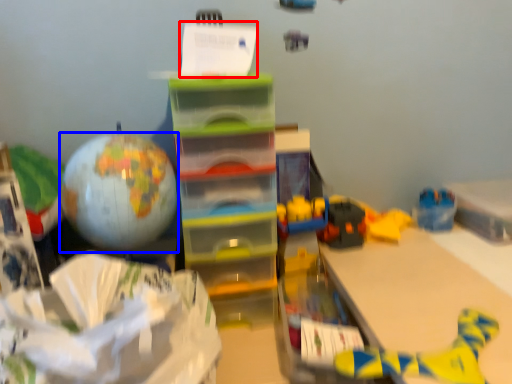
Question: Which point is further to the camera, writing (highlighted by a red box) or balloon (highlighted by a blue box)?

Choices:
 (A) writing
 (B) balloon

Answer: (A)